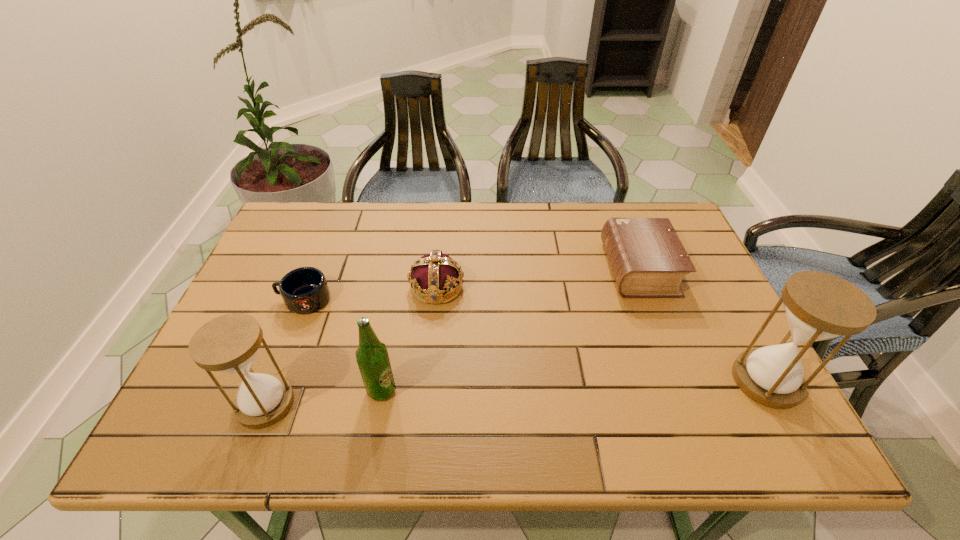
Where is `free spot that satisfies the following two spatial constraints: 1. on the spine side of the fifth object from left to right; 2. on the left side of the taller hourglass`? The height and width of the screenshot is (540, 960). free spot that satisfies the following two spatial constraints: 1. on the spine side of the fifth object from left to right; 2. on the left side of the taller hourglass is located at coordinates (682, 381).